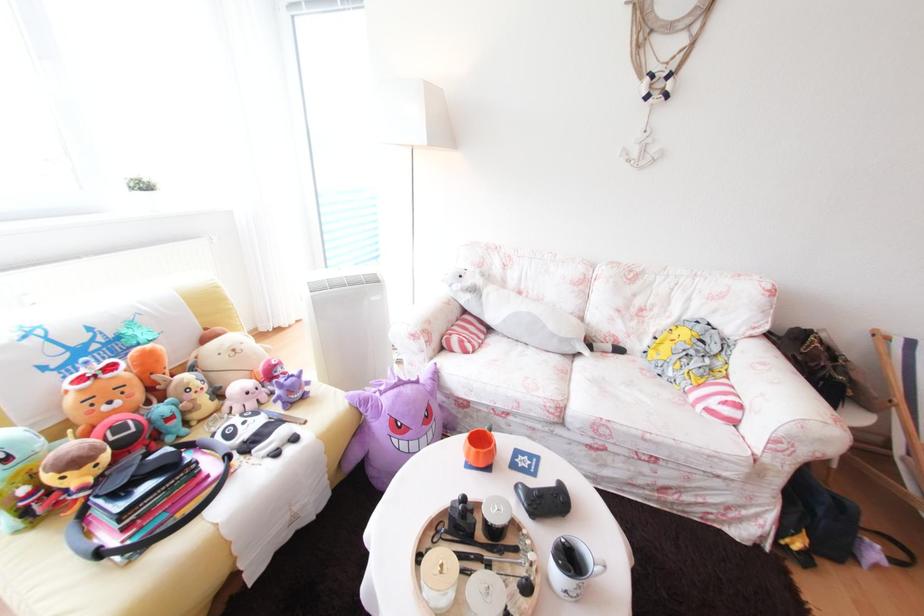
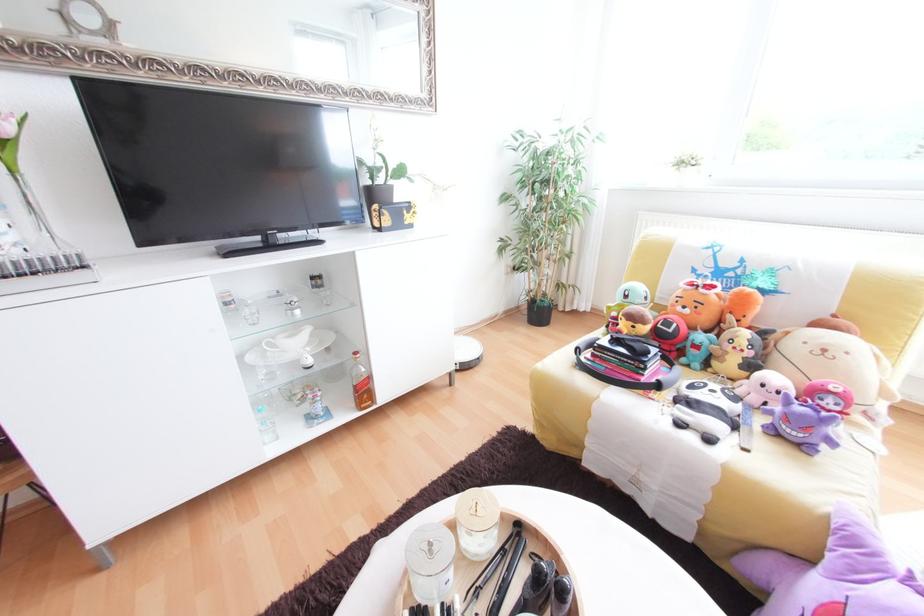
In the second image, find the point that corresponds to pixel 302 440 in the first image.

(718, 440)